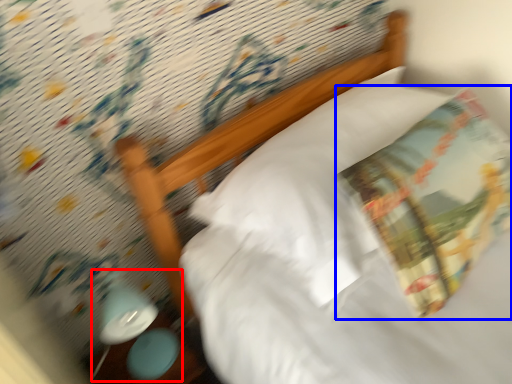
Question: Which of the following is the closest to the observer, lamp (highlighted by a red box) or throw pillow (highlighted by a blue box)?

Choices:
 (A) lamp
 (B) throw pillow

Answer: (B)